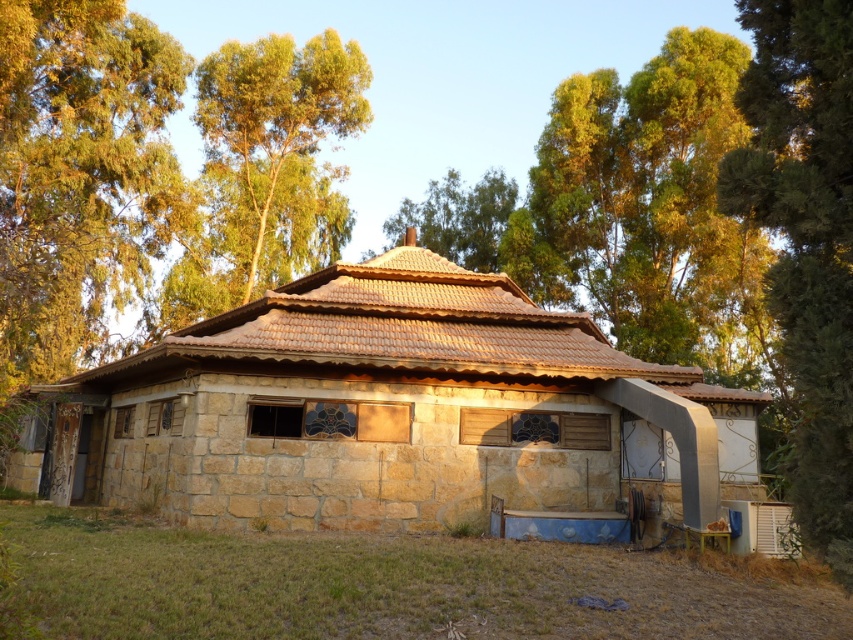
Who is positioned more to the right, green leafy tree at right or green leafy tree at upper left?

green leafy tree at right is more to the right.

Between green leafy tree at right and green leafy tree at upper left, which one has less height?

green leafy tree at right

Between point (817, 180) and point (291, 144), which one is positioned in front?

Point (817, 180) is in front.

What are the coordinates of `green leafy tree at right` in the screenshot? It's located at (805, 240).

Which is below, brown stone hut at center or green leafy tree at upper left?

brown stone hut at center

Who is more forward, [381,298] or [148,321]?

Positioned in front is point [381,298].

The image size is (853, 640). I want to click on brown stone hut at center, so click(x=392, y=413).

Is brown stone hut at center below green leafy tree at right?

Actually, brown stone hut at center is above green leafy tree at right.

Who is higher up, brown stone hut at center or green leafy tree at right?

brown stone hut at center

Locate an element on the screen. brown stone hut at center is located at coordinates (392, 413).